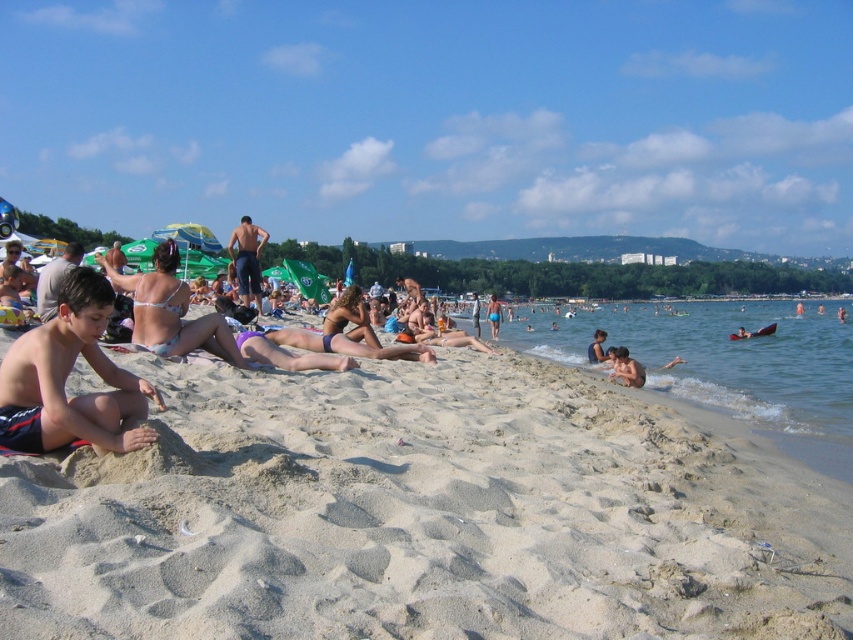
Question: Is dark blue shorts at lower left to the left of dark blue shorts at center from the viewer's perspective?

Choices:
 (A) yes
 (B) no

Answer: (B)

Question: Which is farther from the clear blue water at lower right?

Choices:
 (A) dark blue shorts at center
 (B) dark blue shorts at lower left

Answer: (A)

Question: Does light beige sand at lower left appear on the right side of dark blue shorts at center?

Choices:
 (A) no
 (B) yes

Answer: (B)

Question: Which object is closer to the camera taking this photo?

Choices:
 (A) light beige sand at lower left
 (B) clear blue water at lower right
 (C) dark blue shorts at lower left
 (D) dark blue shorts at center

Answer: (A)

Question: Does light beige sand at lower left have a smaller size compared to dark blue shorts at center?

Choices:
 (A) yes
 (B) no

Answer: (A)

Question: Which point appears farthest from the camera in this image?

Choices:
 (A) (99, 416)
 (B) (231, 253)
 (C) (761, 388)

Answer: (B)